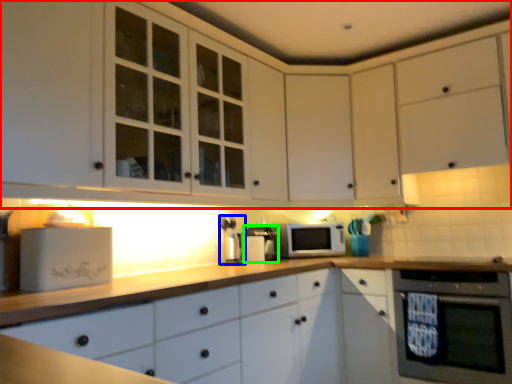
Question: Which object is positioned farthest from cabinetry (highlighted by a red box)? Select from coffee machine (highlighted by a blue box) and coffee machine (highlighted by a green box).

Choices:
 (A) coffee machine
 (B) coffee machine

Answer: (A)